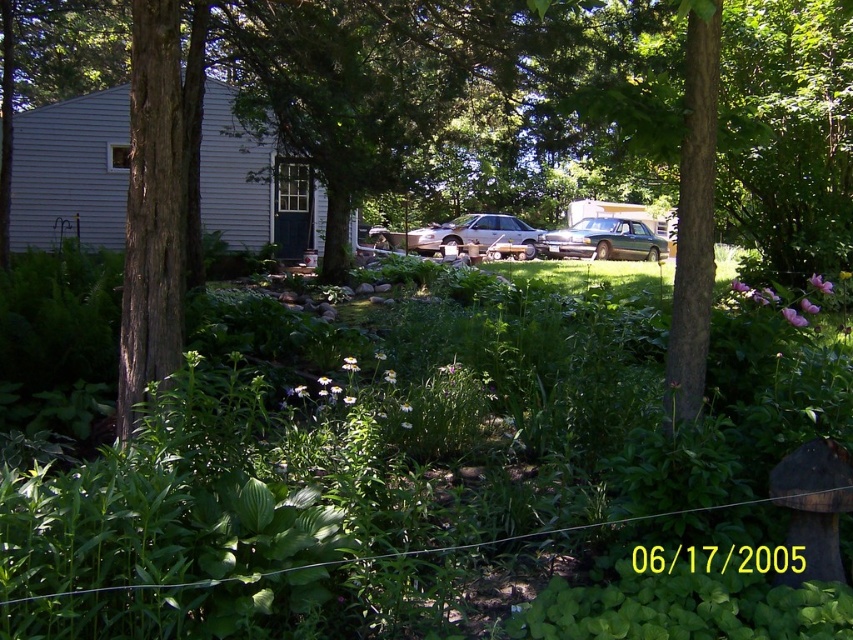
You are standing in the garden and want to locate the brown rough tree at center. Which direction should you look to find it?

The brown rough tree at center is located at point coordinates of (466, 93), so you should look towards the center of the garden to find it.

You are a gardener who wants to plant a new flower bed between the green leafy plants at center and the brown rough tree at center. Based on their heights, which object will cast more shade over the new flower bed?

The brown rough tree at center will cast more shade over the new flower bed because it is taller than the green leafy plants at center.